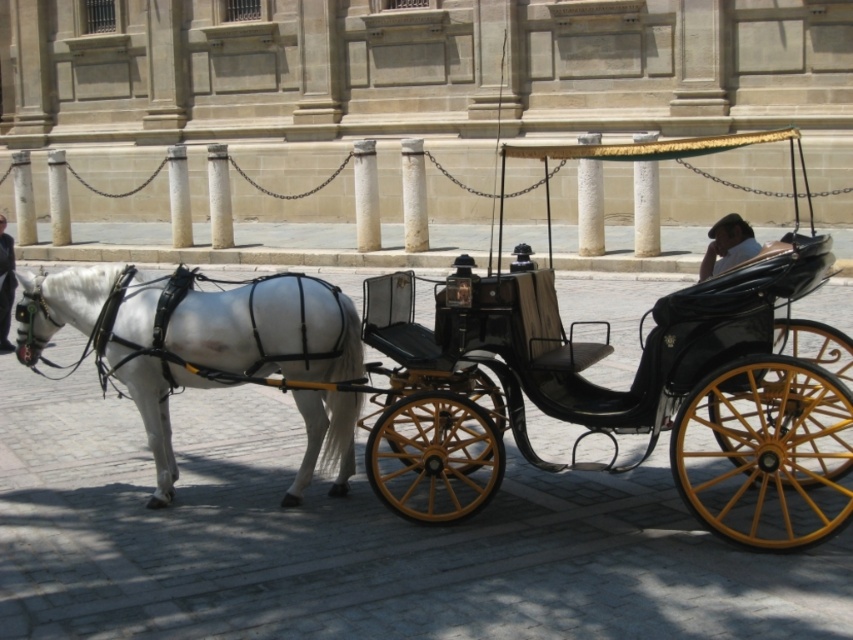
You are a delivery person trying to park your 2.5 meters wide delivery van between the shiny black carriage at center and the light brown leather hat at upper right. Can you fit your van there?

The shiny black carriage at center is narrower than the light brown leather hat at upper right, but the description does not provide the exact width of the space between them. Therefore, it is uncertain if the 2.5 meters wide delivery van can fit between them.

You are standing at the point labeled point [12,285] and want to walk to the point labeled point [376,483]. Which direction should you move to reach your destination?

You should move forward because point [376,483] is in front of point [12,285].

You are a tourist standing on the cobblestone street and want to take a photo of the shiny black carriage at center and the light brown leather hat at upper right. Which object should you zoom in more on to capture both in the frame?

You should zoom in more on the shiny black carriage at center because it is smaller than the light brown leather hat at upper right, so adjusting the zoom to accommodate the smaller size will help both fit in the frame.